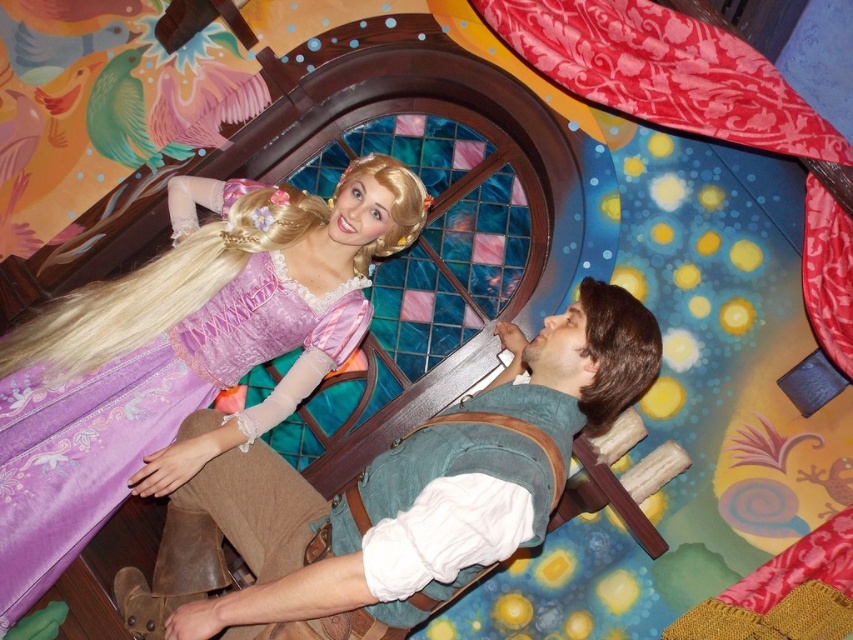
Question: Can you confirm if purple satin dress at upper left is thinner than matte green vest at center?

Choices:
 (A) no
 (B) yes

Answer: (B)

Question: Where is matte green vest at center located in relation to red satin curtain at upper right in the image?

Choices:
 (A) below
 (B) above

Answer: (A)

Question: Which of these objects is positioned farthest from the matte green vest at center?

Choices:
 (A) red satin curtain at upper right
 (B) purple satin dress at upper left

Answer: (A)

Question: Which object is closer to the camera taking this photo?

Choices:
 (A) red satin curtain at upper right
 (B) purple satin dress at upper left

Answer: (B)

Question: Is purple satin dress at upper left wider than matte green vest at center?

Choices:
 (A) no
 (B) yes

Answer: (A)

Question: Which point is farther from the camera taking this photo?

Choices:
 (A) (370, 172)
 (B) (238, 611)
 (C) (743, 118)

Answer: (C)